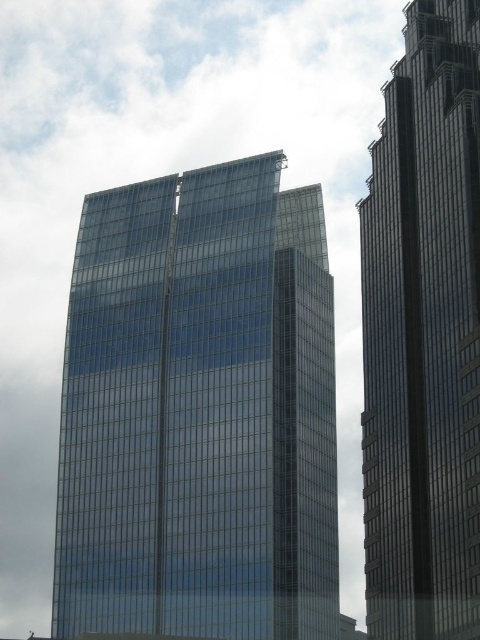
Question: Is transparent glass building at center to the right of glassy steel skyscraper at right from the viewer's perspective?

Choices:
 (A) yes
 (B) no

Answer: (B)

Question: Where is transparent glass building at center located in relation to glassy steel skyscraper at right in the image?

Choices:
 (A) above
 (B) below

Answer: (B)

Question: Is transparent glass building at center thinner than glassy steel skyscraper at right?

Choices:
 (A) yes
 (B) no

Answer: (B)

Question: Which point appears farthest from the camera in this image?

Choices:
 (A) (279, 602)
 (B) (468, 22)

Answer: (B)

Question: Which point appears closest to the camera in this image?

Choices:
 (A) (435, 205)
 (B) (84, 572)

Answer: (A)